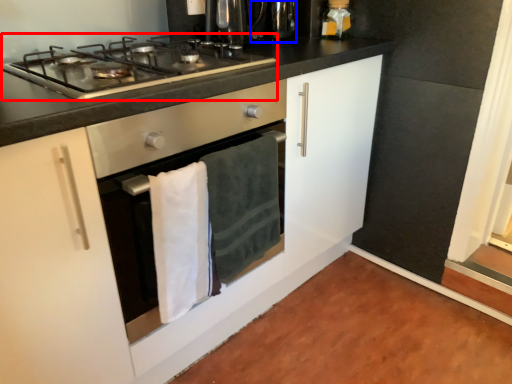
Question: Which of the following is the closest to the observer, gas stove (highlighted by a red box) or appliance (highlighted by a blue box)?

Choices:
 (A) gas stove
 (B) appliance

Answer: (A)